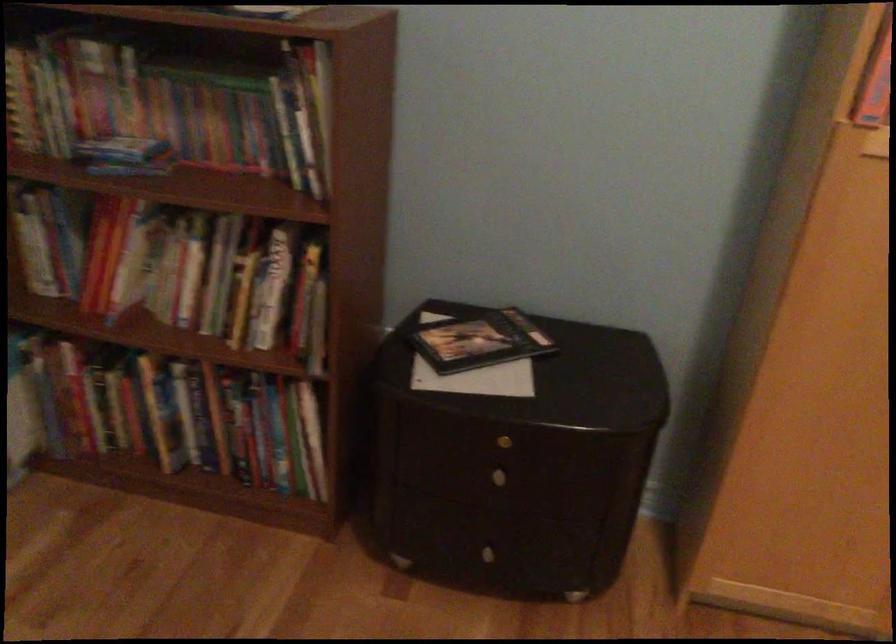
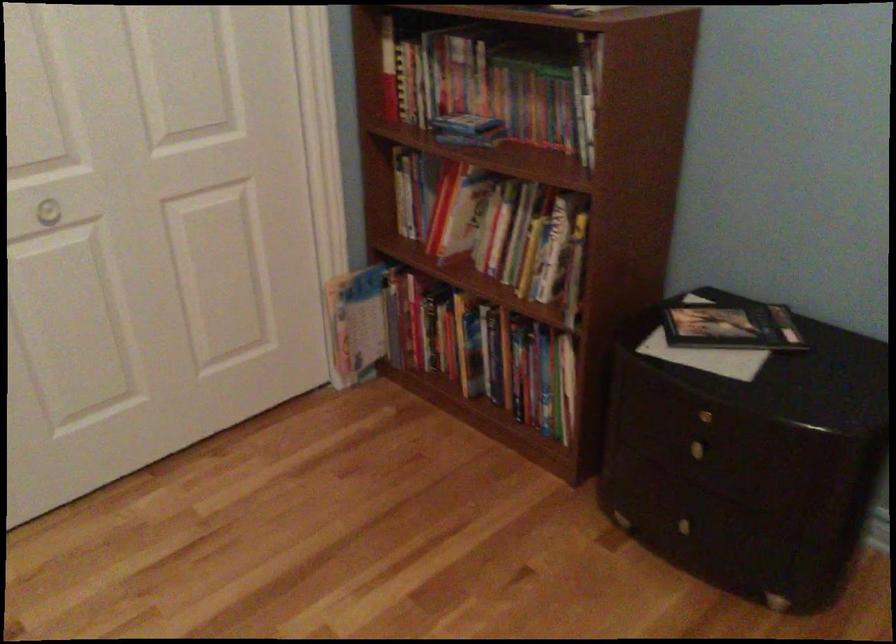
The point at (x=113, y=411) is marked in the first image. Where is the corresponding point in the second image?

(428, 335)